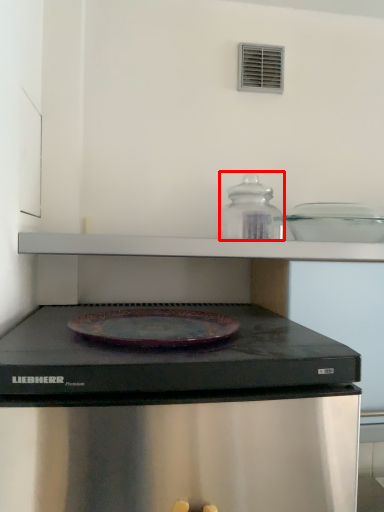
Question: Observing the image, what is the correct spatial positioning of appliance (annotated by the red box) in reference to appliance?

Choices:
 (A) left
 (B) right

Answer: (A)